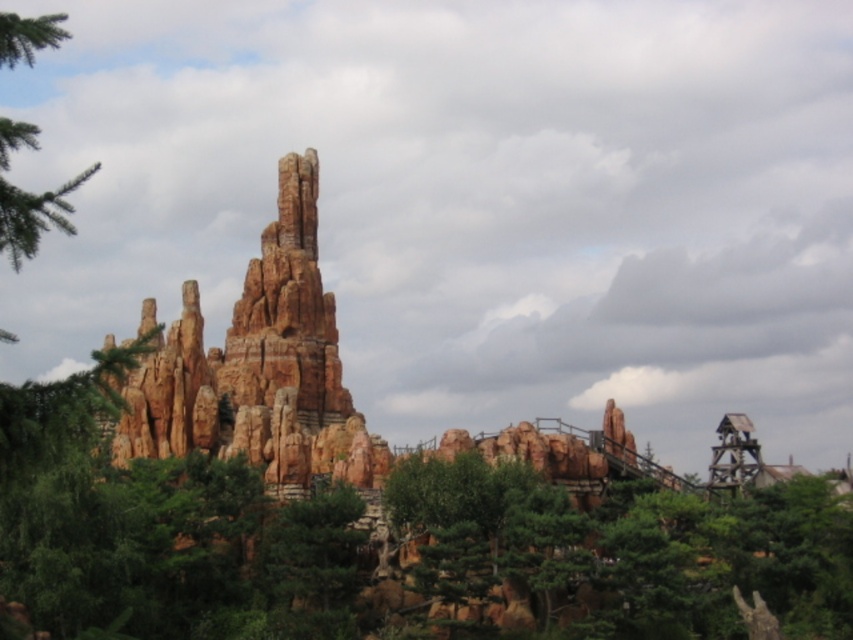
Is point (264, 355) positioned before point (30, 230)?

That is False.

Who is positioned more to the right, rustic stone rock formation at center or green textured tree at upper left?

rustic stone rock formation at center is more to the right.

Locate an element on the screen. The image size is (853, 640). rustic stone rock formation at center is located at coordinates (259, 368).

Locate an element on the screen. This screenshot has width=853, height=640. rustic stone rock formation at center is located at coordinates (259, 368).